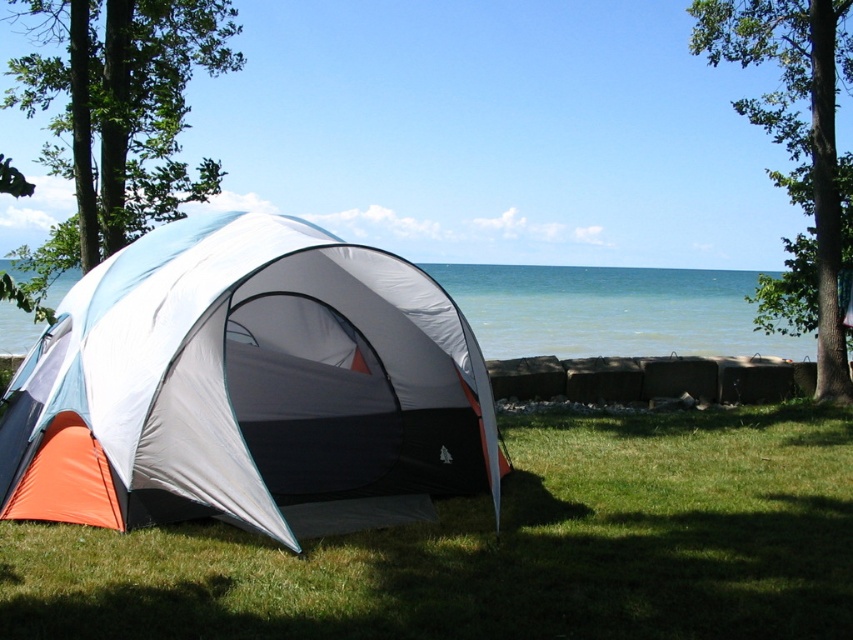
You are standing at the entrance of the tent and want to look at two points in the scene. The first point is at coordinates point (59, 616) and the second is at point (604, 289). Which point will appear closer to you?

The point (59, 616) is closer to the viewer than point (604, 289), so the first point will appear closer to you.

From the picture: You are standing at the camera position and want to place a small flag at the closest point between point (335, 442) and point (676, 289). Which point should you choose?

Point (335, 442) is closer to the camera than point (676, 289), so you should place the flag at point (335, 442).